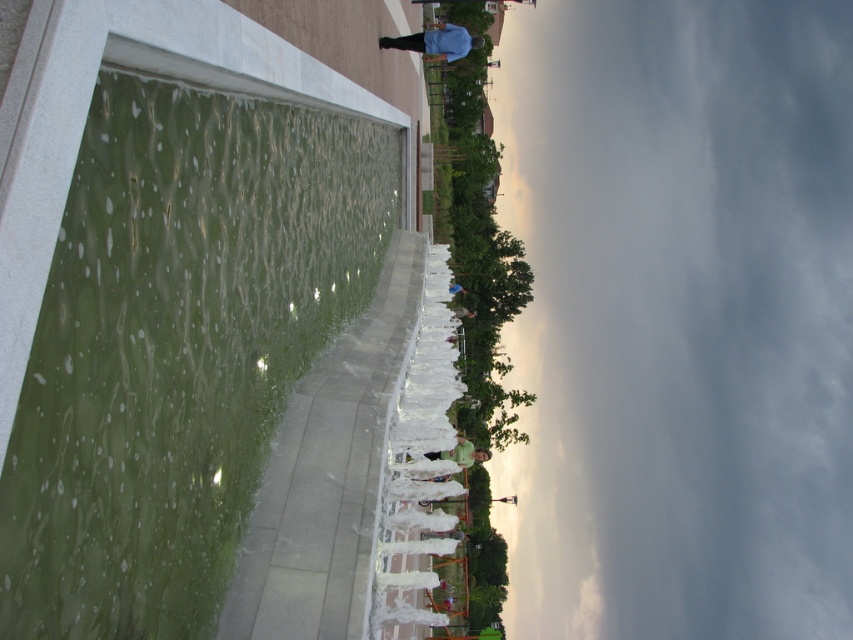
Between green polished stone water at left and light blue shirt at center, which one appears on the right side from the viewer's perspective?

light blue shirt at center

Is green polished stone water at left thinner than light blue shirt at center?

Indeed, green polished stone water at left has a lesser width compared to light blue shirt at center.

Image resolution: width=853 pixels, height=640 pixels. Find the location of `green polished stone water at left`. green polished stone water at left is located at coordinates (177, 346).

Identify the location of green polished stone water at left. Image resolution: width=853 pixels, height=640 pixels. (177, 346).

Between green polished stone water at left and blue fabric shirt at upper center, which one is positioned lower?

green polished stone water at left

Does point (268, 156) come in front of point (465, 49)?

That is True.

Which is in front, point (193, 358) or point (409, 35)?

Positioned in front is point (193, 358).

Identify the location of green polished stone water at left. (177, 346).

Where is `blue fabric shirt at upper center`? This screenshot has height=640, width=853. blue fabric shirt at upper center is located at coordinates (436, 42).

Who is taller, blue fabric shirt at upper center or green matte shirt at center?

blue fabric shirt at upper center

Is point (450, 42) less distant than point (456, 444)?

That is False.

Identify the location of blue fabric shirt at upper center. This screenshot has width=853, height=640. (436, 42).